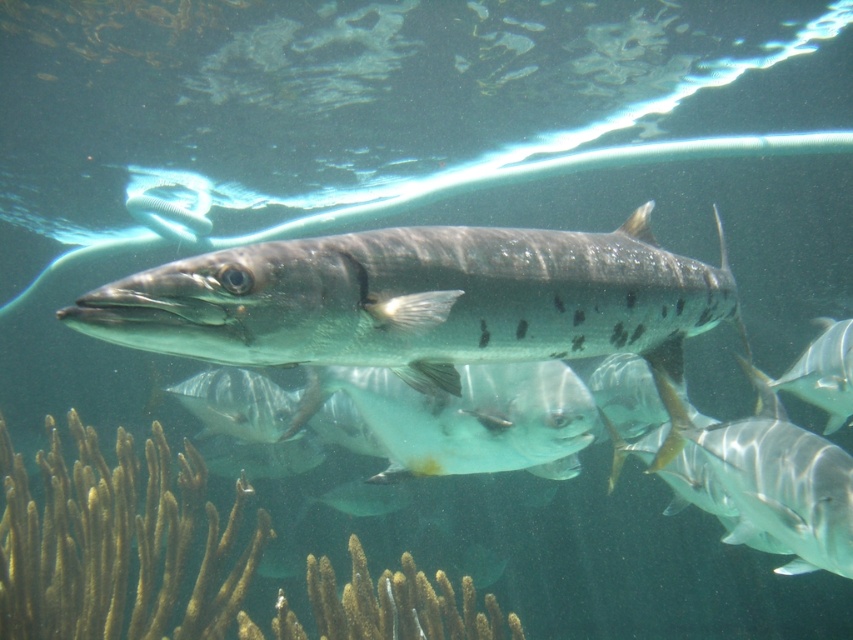
Question: Does shiny silver fish at center appear on the left side of brown textured coral at lower left?

Choices:
 (A) yes
 (B) no

Answer: (B)

Question: Which of the following is the closest to the observer?

Choices:
 (A) (273, 266)
 (B) (198, 604)
 (C) (468, 381)

Answer: (A)

Question: Can you confirm if shiny silver fish at center is smaller than brown textured coral at lower left?

Choices:
 (A) no
 (B) yes

Answer: (B)

Question: Which of the following is the closest to the observer?

Choices:
 (A) shiny silver fish at center
 (B) translucent silver fish at center
 (C) brown textured coral at lower left

Answer: (A)

Question: Does brown textured coral at lower left have a greater width compared to translucent silver fish at center?

Choices:
 (A) yes
 (B) no

Answer: (A)

Question: Which point is closer to the camera taking this photo?

Choices:
 (A) (538, 378)
 (B) (386, 244)
 (C) (260, 532)

Answer: (B)